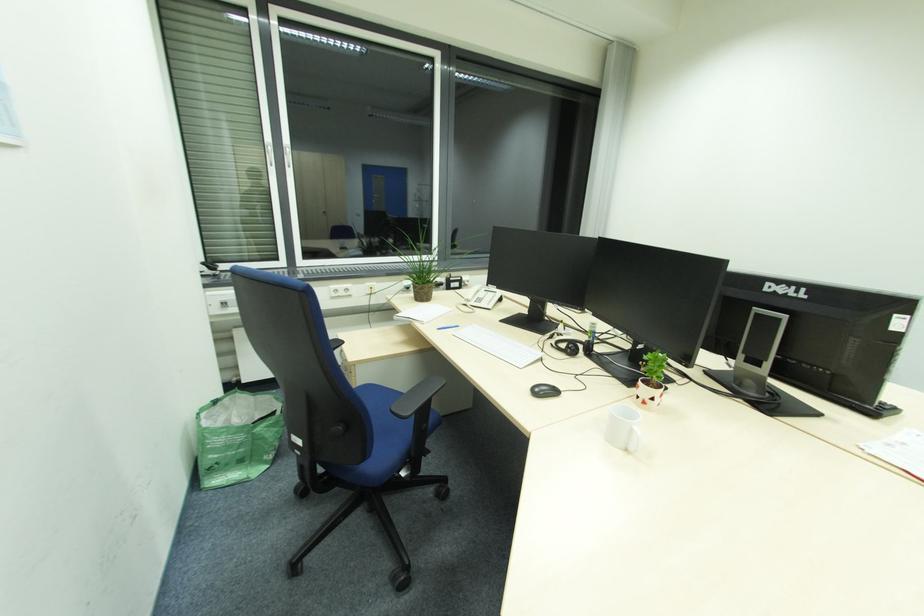
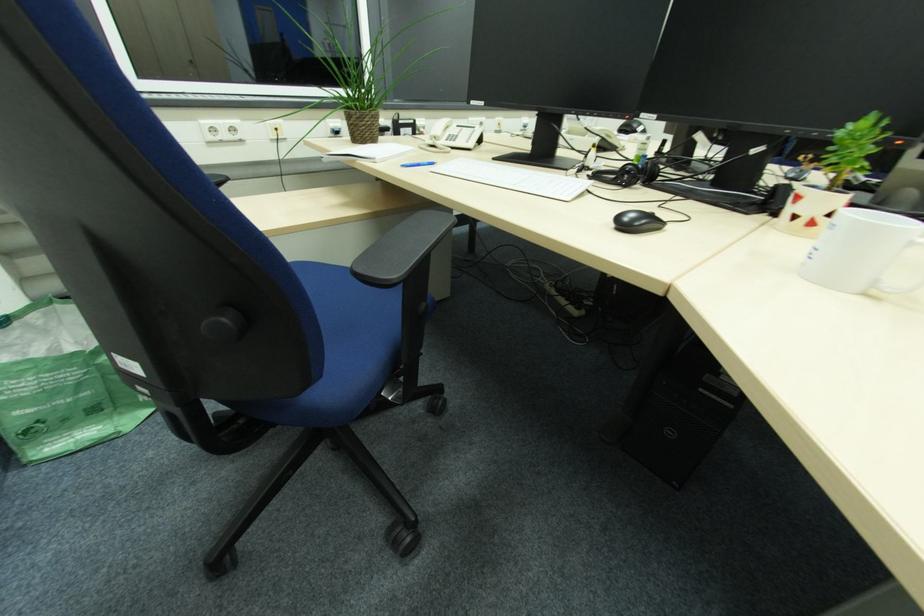
Question: The images are taken continuously from a first-person perspective. In which direction is your viewpoint rotating?

Choices:
 (A) Left
 (B) Right
 (C) Up
 (D) Down

Answer: (D)